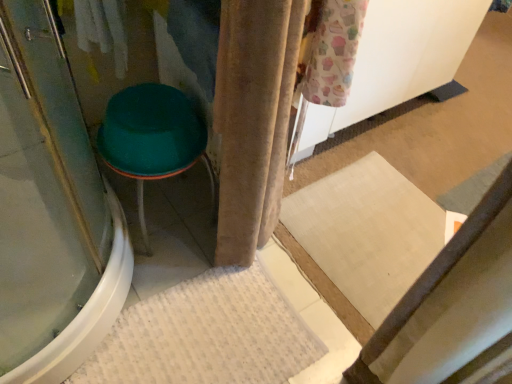
Where is `free space to the left of beige velvet curtain at center`? free space to the left of beige velvet curtain at center is located at coordinates (179, 253).